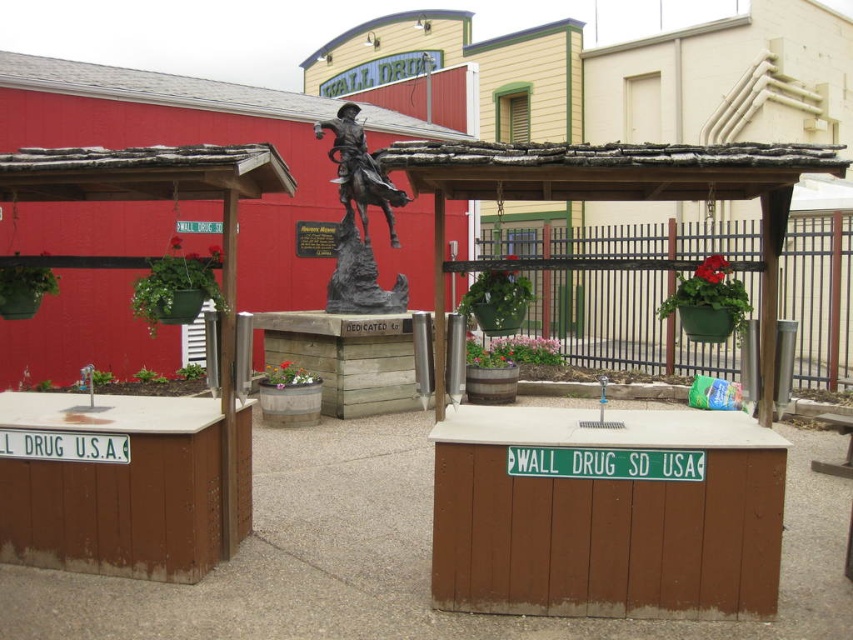
You are a tourist visiting the plaza and want to take a photo of both the green metal fence at center and the bronze statue at center. Since you want both objects in the frame, which one should you move closer to, and why?

You should move closer to the green metal fence at center because it is smaller in size compared to the bronze statue at center. By moving closer to the smaller object, you can ensure both objects fit within the camera frame.

You are a visitor at the plaza and want to take a photo of the bronze statue at center without the green metal fence at center appearing in the shot. Is it possible to do so by moving closer to the statue?

The green metal fence at center is narrower than the bronze statue at center. Since the fence is narrower, moving closer to the statue might allow you to frame the shot so the fence is out of view, but this depends on the exact positioning and angle. However, based on the width difference, it should be possible to avoid the fence by adjusting your position closer to the statue.